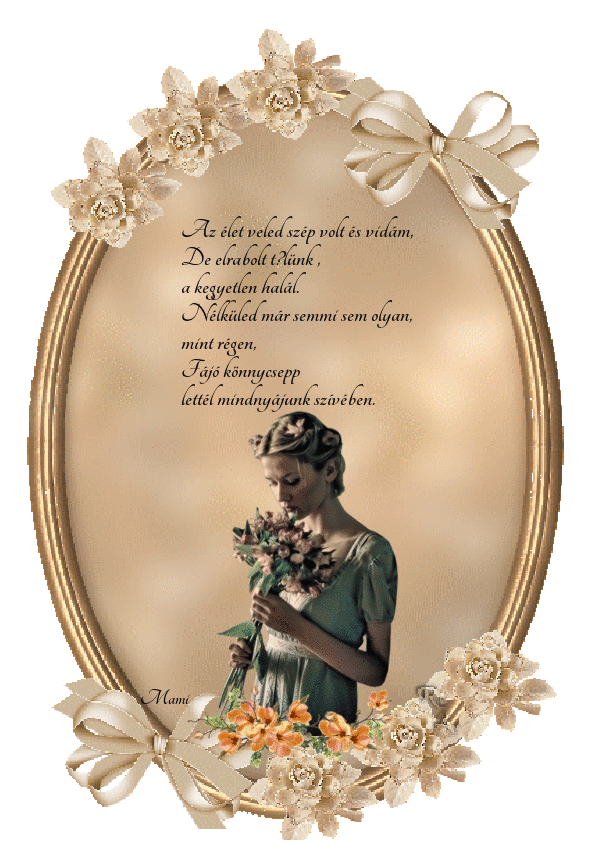
Find the location of a particular element. The width and height of the screenshot is (596, 856). gold oval frame is located at coordinates (73, 270), (40, 474), (83, 635), (514, 611), (530, 331), (498, 245).